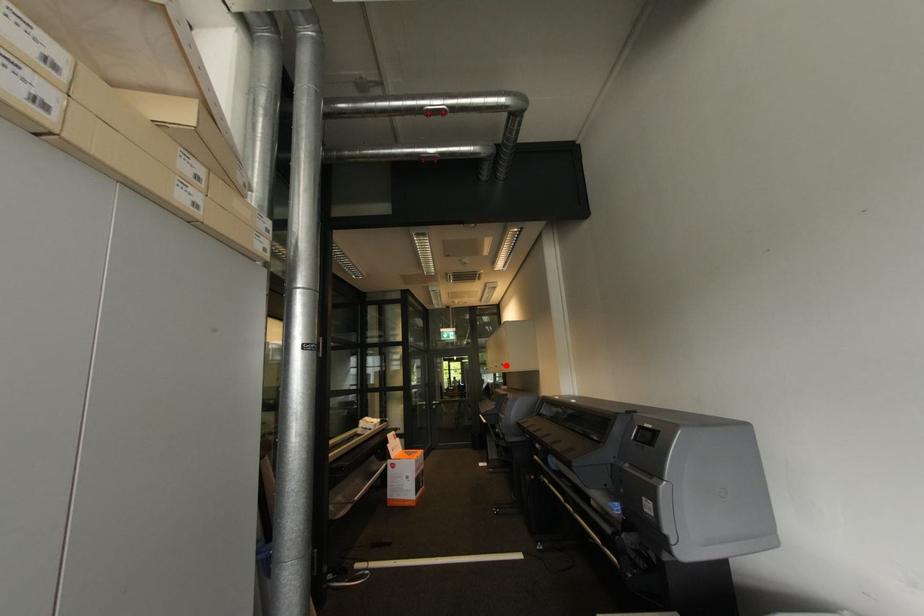
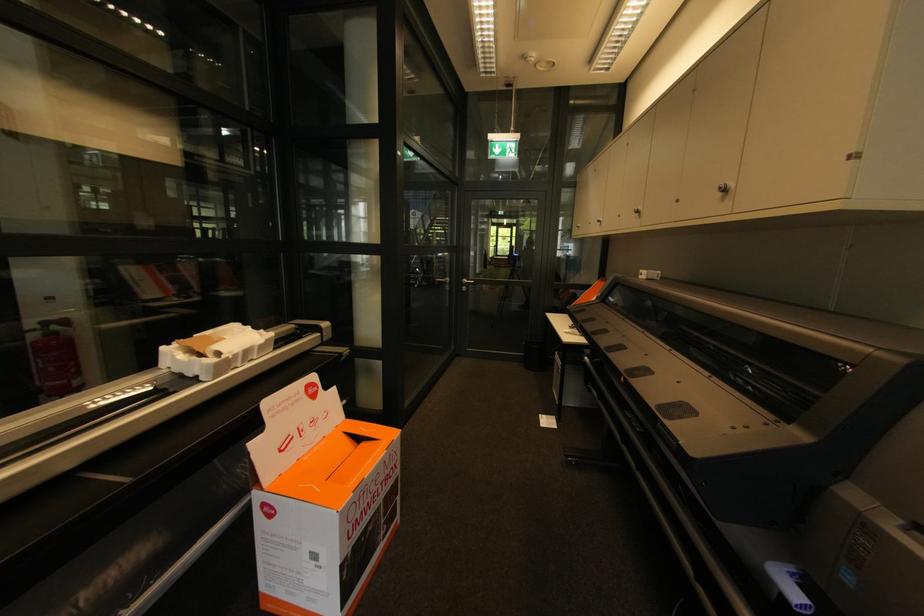
Question: I am providing you with two images of the same scene from different viewpoints. In image1, a red point is highlighted. Considering the same 3D point in image2, which of the following is correct?

Choices:
 (A) It is closer
 (B) It is farther

Answer: (A)